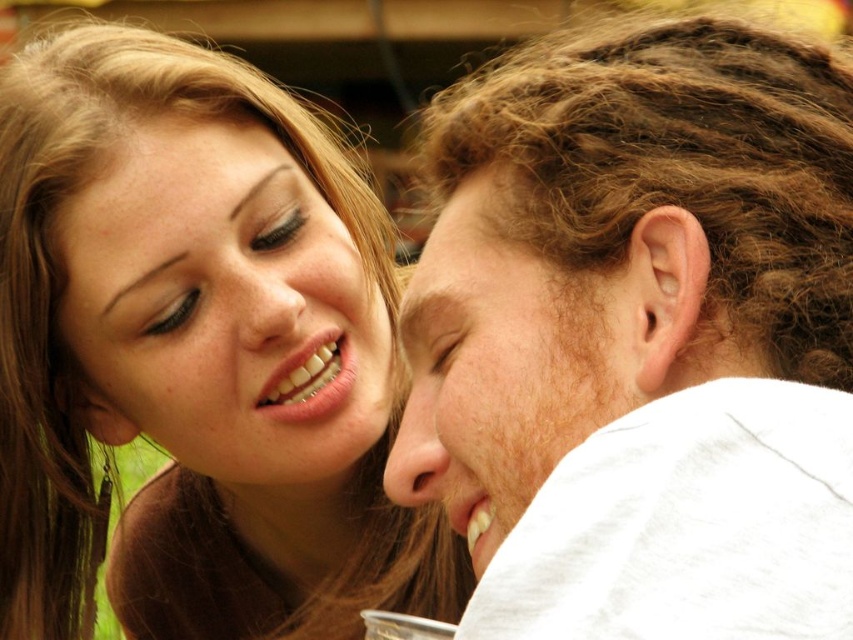
Who is more forward, (686, 625) or (520, 358)?

Point (686, 625) is in front.

In the scene shown: Does light brown hair at right appear on the left side of light brown curly hair at right?

In fact, light brown hair at right is to the right of light brown curly hair at right.

Between point (761, 182) and point (485, 340), which one is positioned behind?

The point (485, 340) is more distant.

Where is `light brown hair at right`? light brown hair at right is located at coordinates (641, 337).

Which is more to the left, smooth brown hair at upper left or smooth skin face at upper left?

From the viewer's perspective, smooth brown hair at upper left appears more on the left side.

Which is below, smooth brown hair at upper left or smooth skin face at upper left?

smooth brown hair at upper left

The height and width of the screenshot is (640, 853). I want to click on smooth brown hair at upper left, so coord(195,355).

Where is `smooth brown hair at upper left`? smooth brown hair at upper left is located at coordinates (195, 355).

Can you confirm if smooth brown hair at upper left is positioned to the left of light brown curly hair at right?

Indeed, smooth brown hair at upper left is positioned on the left side of light brown curly hair at right.

Describe the element at coordinates (195, 355) in the screenshot. I see `smooth brown hair at upper left` at that location.

The width and height of the screenshot is (853, 640). Find the location of `smooth brown hair at upper left`. smooth brown hair at upper left is located at coordinates (195, 355).